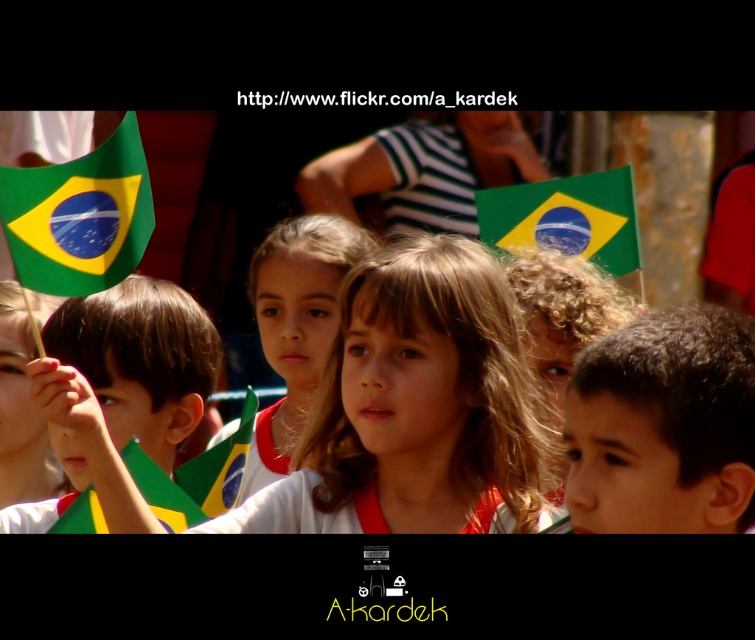
Looking at this image, is matte green flag at left to the left of matte white shirt at center from the viewer's perspective?

Indeed, matte green flag at left is positioned on the left side of matte white shirt at center.

Between matte green flag at left and matte white shirt at center, which one appears on the left side from the viewer's perspective?

Positioned to the left is matte green flag at left.

Measure the distance between matte green flag at left and camera.

A distance of 26.30 feet exists between matte green flag at left and camera.

You are a GUI agent. You are given a task and a screenshot of the screen. Output one action in this format:
    pyautogui.click(x=<x>, y=<y>)
    Task: Click on the matte green flag at left
    The image size is (755, 640).
    Given the screenshot: What is the action you would take?
    pyautogui.click(x=119, y=394)

Can you confirm if short brown hair boy at center is positioned to the left of green fabric flag at center?

Incorrect, short brown hair boy at center is not on the left side of green fabric flag at center.

Is short brown hair boy at center to the right of green fabric flag at center from the viewer's perspective?

Yes, short brown hair boy at center is to the right of green fabric flag at center.

The height and width of the screenshot is (640, 755). I want to click on short brown hair boy at center, so click(663, 426).

Who is higher up, short brown hair boy at center or matte white shirt at center?

matte white shirt at center is above.

Identify the location of short brown hair boy at center. The image size is (755, 640). point(663,426).